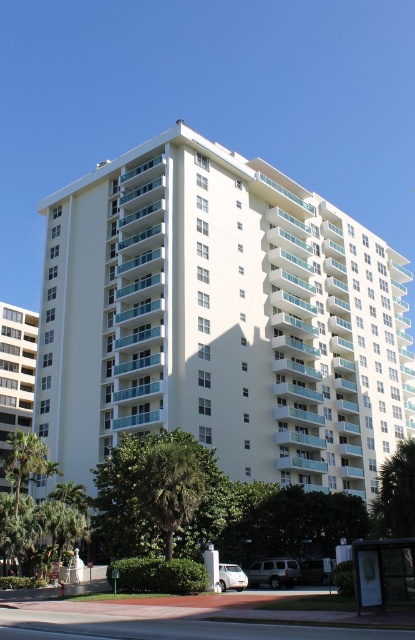
Question: In this image, where is white concrete building at left located relative to metallic silver bus stop at lower right?

Choices:
 (A) left
 (B) right

Answer: (A)

Question: Estimate the real-world distances between objects in this image. Which object is closer to the green leafy palm tree at lower center?

Choices:
 (A) metallic silver bus stop at lower right
 (B) white concrete building at left

Answer: (A)

Question: Which of the following is the closest to the observer?

Choices:
 (A) (385, 595)
 (B) (158, 452)
 (C) (4, 445)
 (D) (180, 394)

Answer: (A)

Question: Is green leafy palm tree at lower center to the right of metallic silver bus stop at lower right from the viewer's perspective?

Choices:
 (A) no
 (B) yes

Answer: (A)

Question: Which point is closer to the camera?

Choices:
 (A) (405, 556)
 (B) (21, 355)

Answer: (A)

Question: Does white concrete building at left have a lesser width compared to metallic silver bus stop at lower right?

Choices:
 (A) yes
 (B) no

Answer: (B)